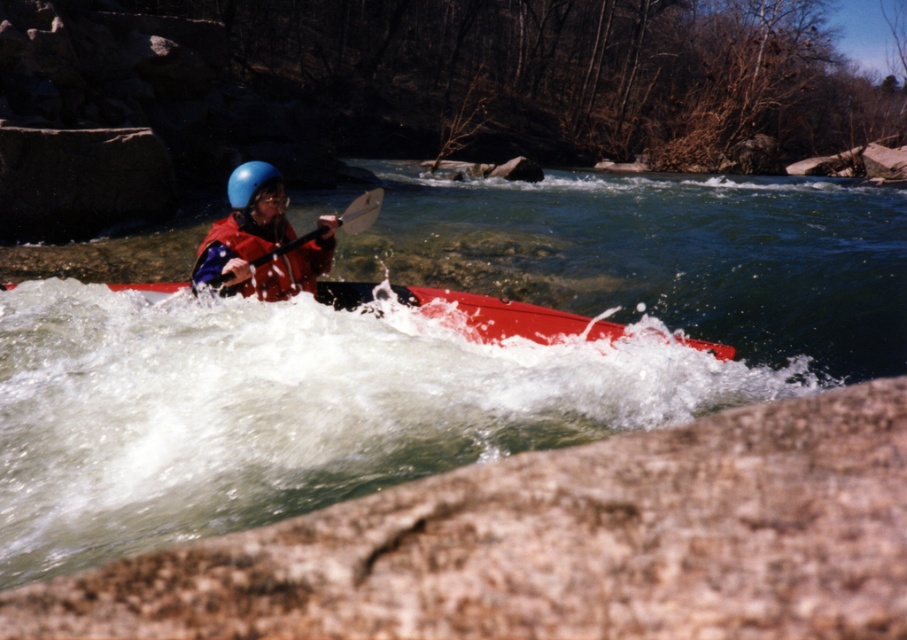
Question: Among these objects, which one is farthest from the camera?

Choices:
 (A) blue matte helmet at center
 (B) smooth water at center
 (C) smooth red canoe at center
 (D) black plastic paddle at center

Answer: (A)

Question: Is smooth red canoe at center above blue matte helmet at center?

Choices:
 (A) no
 (B) yes

Answer: (A)

Question: Which of the following is the farthest from the observer?

Choices:
 (A) (364, 225)
 (B) (381, 323)

Answer: (A)

Question: Which object is positioned farthest from the smooth water at center?

Choices:
 (A) smooth red canoe at center
 (B) blue matte helmet at center
 (C) black plastic paddle at center

Answer: (B)

Question: In this image, where is smooth red canoe at center located relative to black plastic paddle at center?

Choices:
 (A) below
 (B) above

Answer: (A)

Question: Does smooth water at center have a lesser width compared to black plastic paddle at center?

Choices:
 (A) no
 (B) yes

Answer: (A)